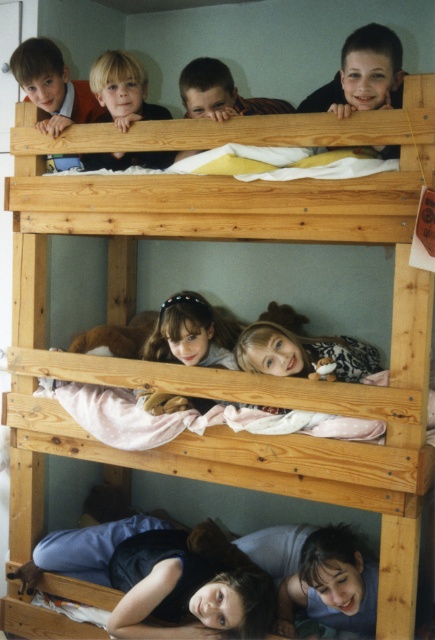
You are standing in the room with the bunk beds. You notice a dark blue fabric at lower center. Where exactly is it located in the room?

The dark blue fabric at lower center is located at point (160, 577) in the room.

You are a photographer taking a picture of the light brown hairband at center and the blonde hair at upper left. Which object should you focus on if you want to capture the smaller one?

The light brown hairband at center should be focused on because it occupies less space than the blonde hair at upper left.